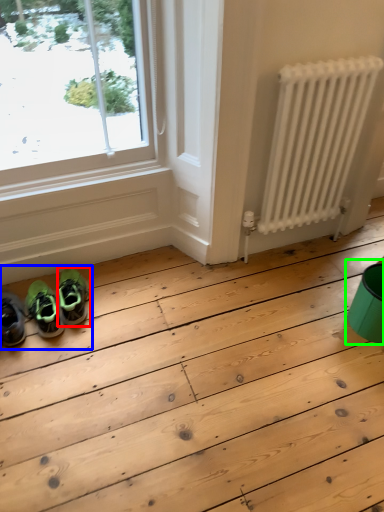
Question: Which is farther away from footwear (highlighted by a red box)? couple (highlighted by a blue box) or teal (highlighted by a green box)?

Choices:
 (A) couple
 (B) teal

Answer: (B)